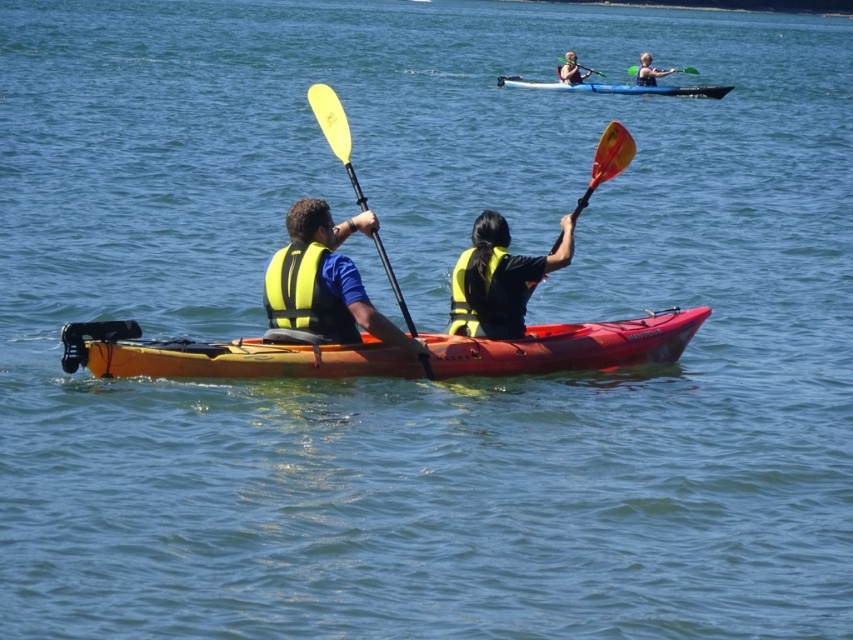
Between yellow matte paddle at center and yellow life vest at center, which one appears on the left side from the viewer's perspective?

yellow matte paddle at center

Between yellow matte paddle at center and yellow life vest at center, which one is positioned higher?

yellow life vest at center

What do you see at coordinates (334, 131) in the screenshot? This screenshot has height=640, width=853. I see `yellow matte paddle at center` at bounding box center [334, 131].

Find the location of a particular element. The image size is (853, 640). yellow matte paddle at center is located at coordinates (334, 131).

Measure the distance between yellow matte life jacket at center and yellow rubber paddle at upper center.

They are 386.76 feet apart.

Between point (462, 285) and point (625, 68), which one is positioned in front?

Point (462, 285)

At what (x,y) coordinates should I click in order to perform the action: click on yellow matte life jacket at center. Please return your answer as a coordinate pair (x, y). Looking at the image, I should click on (490, 292).

The height and width of the screenshot is (640, 853). Identify the location of yellow matte life jacket at center. (490, 292).

Identify the location of yellow life vest at left. (325, 280).

Which is below, yellow life vest at left or yellow matte life vest at center?

Positioned lower is yellow life vest at left.

Is point (358, 214) closer to viewer compared to point (461, 316)?

No, (358, 214) is further to viewer.

Identify the location of yellow life vest at left. This screenshot has width=853, height=640. (325, 280).